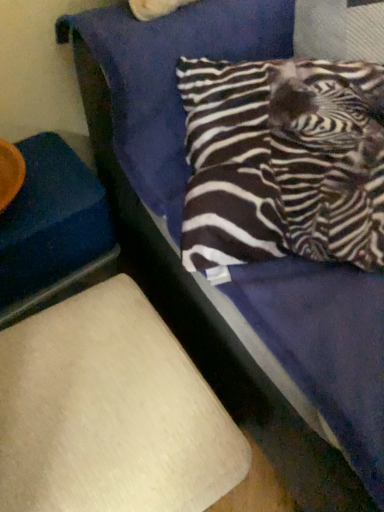
Question: Is beige fabric lampshade at lower left, the 2th furniture viewed from the top, turned away from zebra-patterned fabric pillow at upper right?

Choices:
 (A) no
 (B) yes

Answer: (A)

Question: Does beige fabric lampshade at lower left, which ranks as the first furniture in bottom-to-top order, have a greater width compared to zebra-patterned fabric pillow at upper right?

Choices:
 (A) no
 (B) yes

Answer: (B)

Question: From a real-world perspective, is beige fabric lampshade at lower left, which ranks as the first furniture in bottom-to-top order, located higher than zebra-patterned fabric pillow at upper right?

Choices:
 (A) no
 (B) yes

Answer: (A)

Question: Could you tell me if beige fabric lampshade at lower left, the 2th furniture viewed from the top, is facing zebra-patterned fabric pillow at upper right?

Choices:
 (A) no
 (B) yes

Answer: (A)

Question: Is beige fabric lampshade at lower left, which ranks as the first furniture in bottom-to-top order, to the right of zebra-patterned fabric pillow at upper right from the viewer's perspective?

Choices:
 (A) no
 (B) yes

Answer: (A)

Question: Is beige fabric lampshade at lower left, which ranks as the first furniture in bottom-to-top order, completely or partially outside of zebra-patterned fabric pillow at upper right?

Choices:
 (A) no
 (B) yes

Answer: (B)

Question: Is zebra-patterned fabric pillow at upper right at the left side of beige fabric lampshade at lower left, the 2th furniture viewed from the top?

Choices:
 (A) yes
 (B) no

Answer: (B)

Question: Does zebra-patterned fabric pillow at upper right have a greater width compared to beige fabric lampshade at lower left, the 2th furniture viewed from the top?

Choices:
 (A) no
 (B) yes

Answer: (A)

Question: Is zebra-patterned fabric pillow at upper right thinner than beige fabric lampshade at lower left, the 2th furniture viewed from the top?

Choices:
 (A) no
 (B) yes

Answer: (B)

Question: Considering the relative positions of zebra-patterned fabric pillow at upper right and beige fabric lampshade at lower left, the 2th furniture viewed from the top, in the image provided, is zebra-patterned fabric pillow at upper right behind beige fabric lampshade at lower left, the 2th furniture viewed from the top,?

Choices:
 (A) yes
 (B) no

Answer: (A)

Question: From a real-world perspective, is zebra-patterned fabric pillow at upper right positioned under beige fabric lampshade at lower left, which ranks as the first furniture in bottom-to-top order, based on gravity?

Choices:
 (A) yes
 (B) no

Answer: (B)

Question: Is zebra-patterned fabric pillow at upper right to the right of beige fabric lampshade at lower left, the 2th furniture viewed from the top, from the viewer's perspective?

Choices:
 (A) yes
 (B) no

Answer: (A)

Question: Considering the relative positions of blue fabric at left, which is counted as the 1th furniture, starting from the top, and beige fabric lampshade at lower left, the 2th furniture viewed from the top, in the image provided, is blue fabric at left, which is counted as the 1th furniture, starting from the top, to the left of beige fabric lampshade at lower left, the 2th furniture viewed from the top, from the viewer's perspective?

Choices:
 (A) no
 (B) yes

Answer: (B)